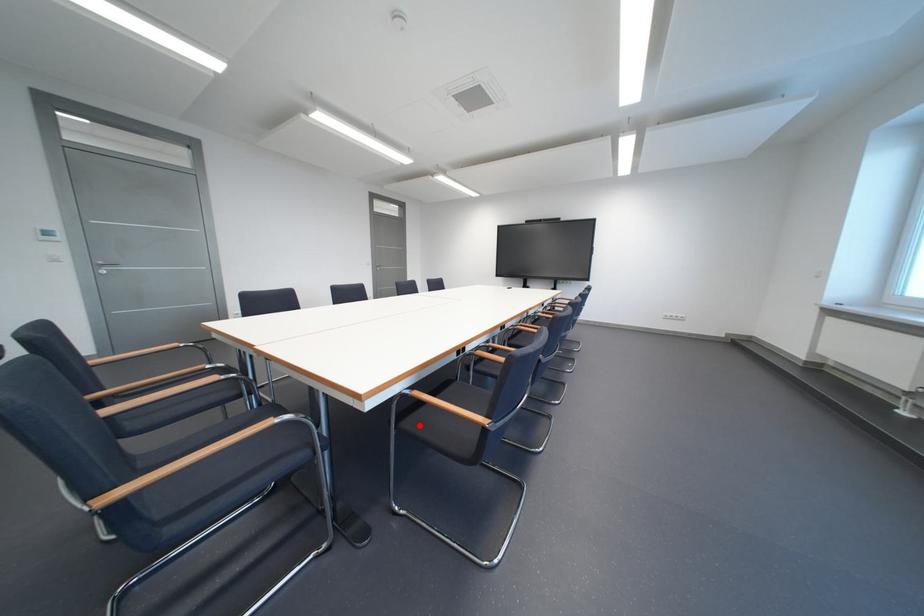
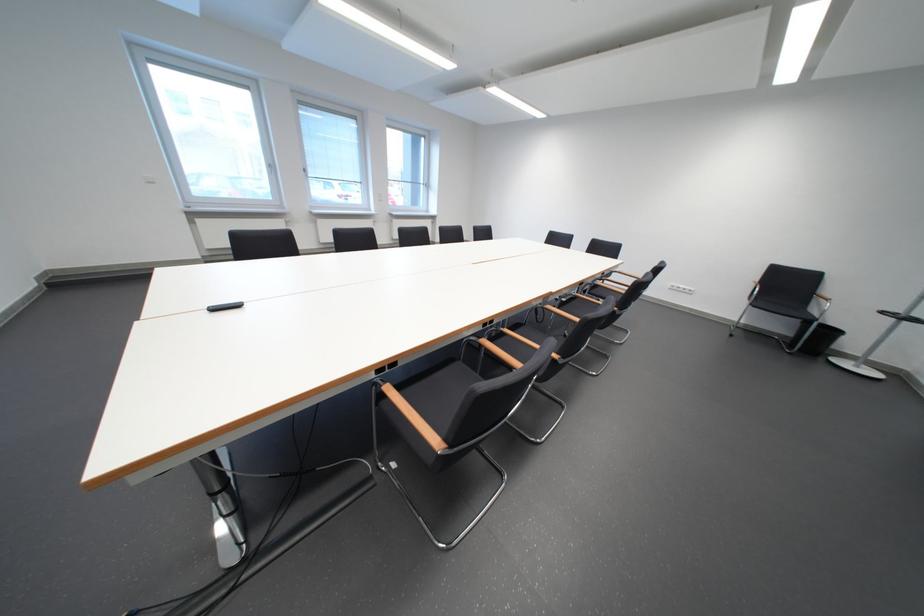
Question: I am providing you with two images of the same scene from different viewpoints. A red point is marked on the first image. Is the red point's position out of view in image 2?

Choices:
 (A) Yes
 (B) No

Answer: (A)